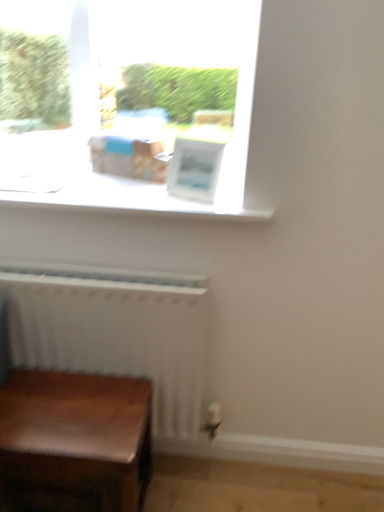
Question: Considering the relative positions of white matte window sill at upper center and white matte radiator at lower left in the image provided, is white matte window sill at upper center to the left or to the right of white matte radiator at lower left?

Choices:
 (A) right
 (B) left

Answer: (A)

Question: Does point (18, 181) appear closer or farther from the camera than point (79, 360)?

Choices:
 (A) farther
 (B) closer

Answer: (B)

Question: Which object is positioned farthest from the wooden table at lower left?

Choices:
 (A) white matte window sill at upper center
 (B) white matte radiator at lower left

Answer: (A)

Question: Which is farther from the white matte window sill at upper center?

Choices:
 (A) white matte radiator at lower left
 (B) wooden table at lower left

Answer: (B)